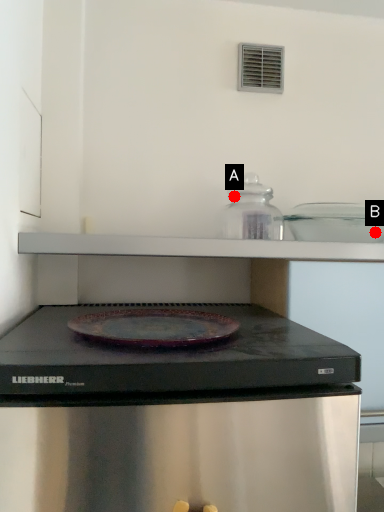
Question: Two points are circled on the image, labeled by A and B beside each circle. Which of the following is the closest to the observer?

Choices:
 (A) A is closer
 (B) B is closer

Answer: (A)